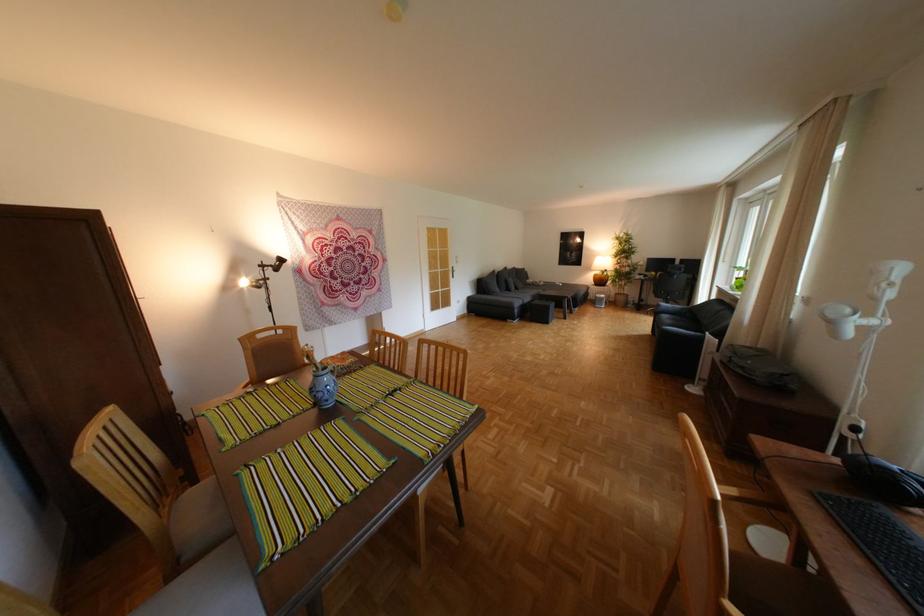
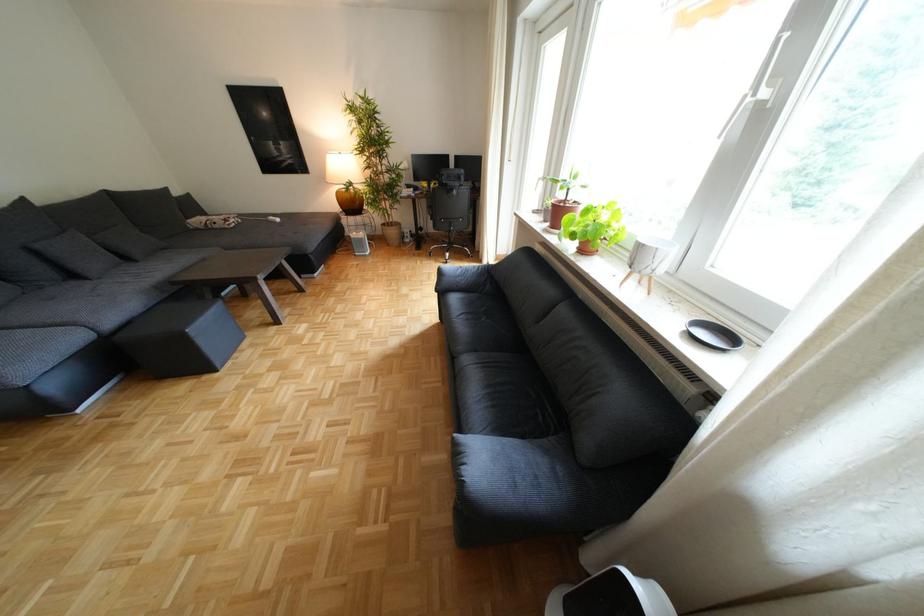
Find the pixel in the second image that matches point 518,282 in the first image.

(49, 253)